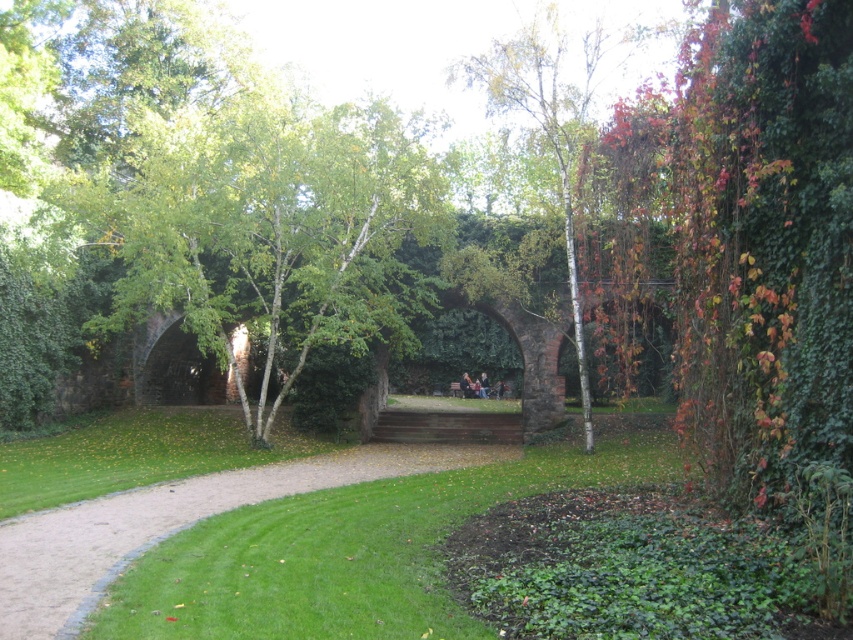
Is green leafy tree at center to the right of green grass at center from the viewer's perspective?

Incorrect, green leafy tree at center is not on the right side of green grass at center.

Looking at this image, between green leafy tree at center and green grass at center, which one is positioned higher?

Positioned higher is green leafy tree at center.

The height and width of the screenshot is (640, 853). Identify the location of green leafy tree at center. (273, 230).

Is green leafy tree at center further to camera compared to white bark tree at center?

No.

Does green leafy tree at center appear under white bark tree at center?

Yes.

Does point (276, 317) lie in front of point (572, 316)?

Yes, point (276, 317) is closer to viewer.

Where is `green leafy tree at center`? green leafy tree at center is located at coordinates (273, 230).

Which is more to the right, green grass at center or white bark tree at center?

white bark tree at center

Consider the image. Which of these two, green grass at center or white bark tree at center, stands taller?

With more height is white bark tree at center.

Which is in front, point (247, 540) or point (498, 68)?

Point (247, 540)

At what (x,y) coordinates should I click in order to perform the action: click on green grass at center. Please return your answer as a coordinate pair (x, y). Looking at the image, I should click on (358, 547).